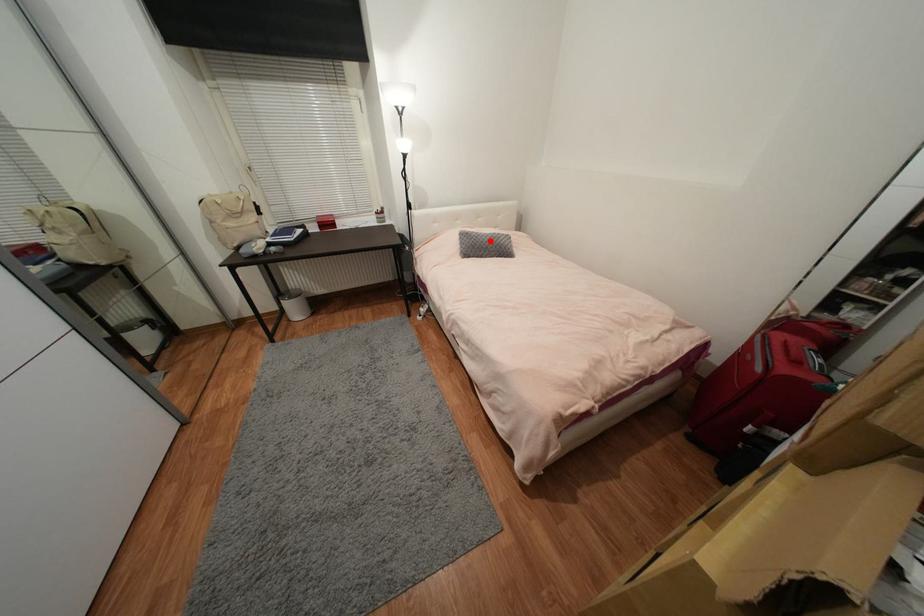
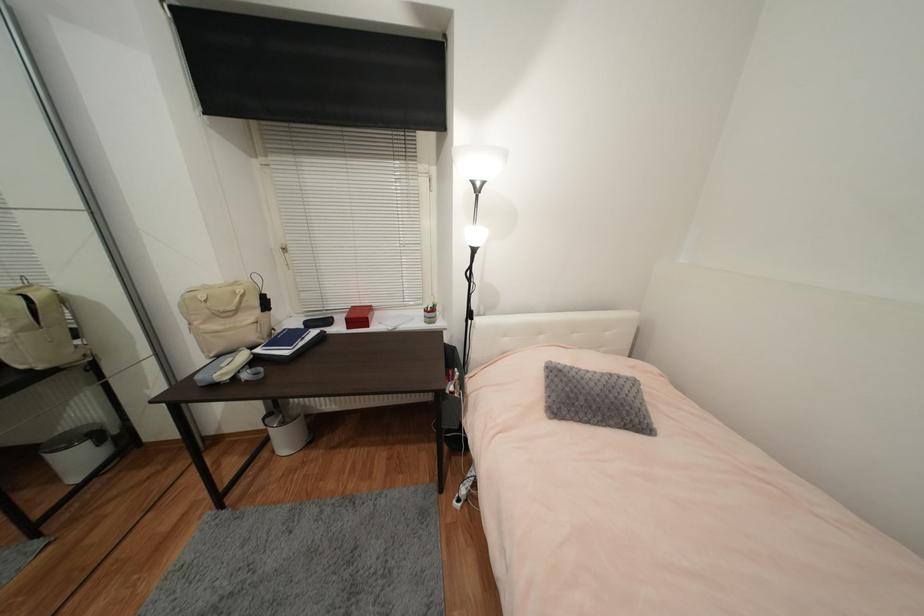
Question: I am providing you with two images of the same scene from different viewpoints. Image1 has a red point marked. In image2, the corresponding 3D location appears at what relative position? Reply with the corresponding letter.

Choices:
 (A) Closer
 (B) Farther

Answer: (B)